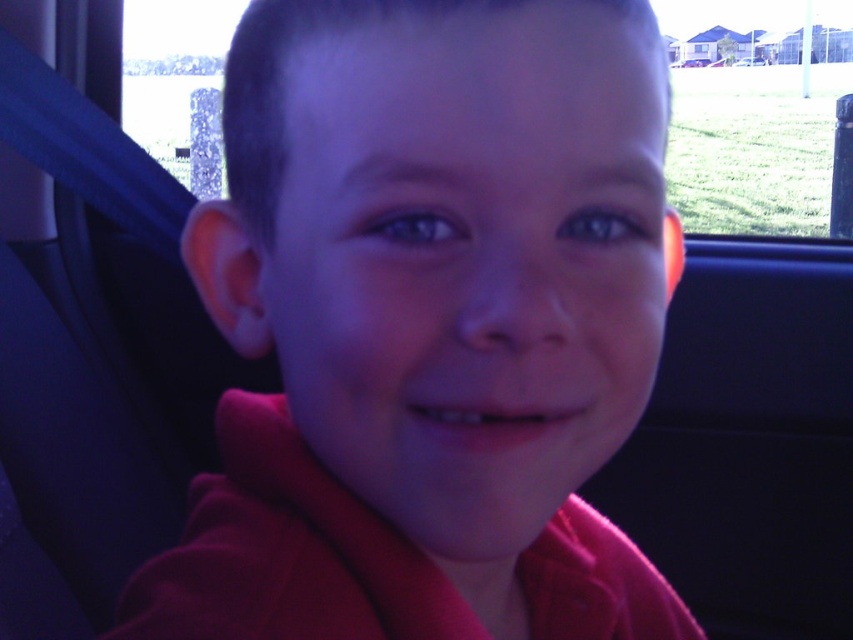
Which is behind, point (494, 83) or point (817, 134)?

The point (817, 134) is more distant.

Can you confirm if matte red shirt at center is positioned to the left of transparent glass car window at upper center?

Correct, you'll find matte red shirt at center to the left of transparent glass car window at upper center.

This screenshot has width=853, height=640. I want to click on matte red shirt at center, so click(428, 324).

Identify the location of matte red shirt at center. The width and height of the screenshot is (853, 640). [428, 324].